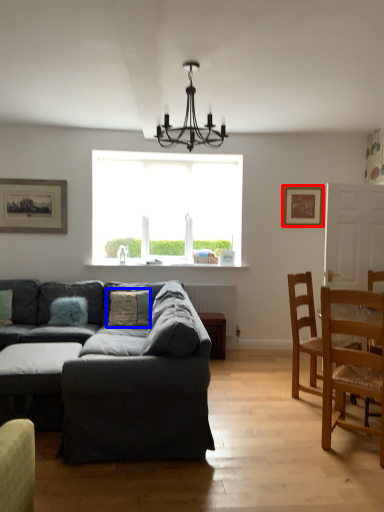
Question: Which object appears closest to the camera in this image, picture frame (highlighted by a red box) or pillow (highlighted by a blue box)?

Choices:
 (A) picture frame
 (B) pillow

Answer: (B)